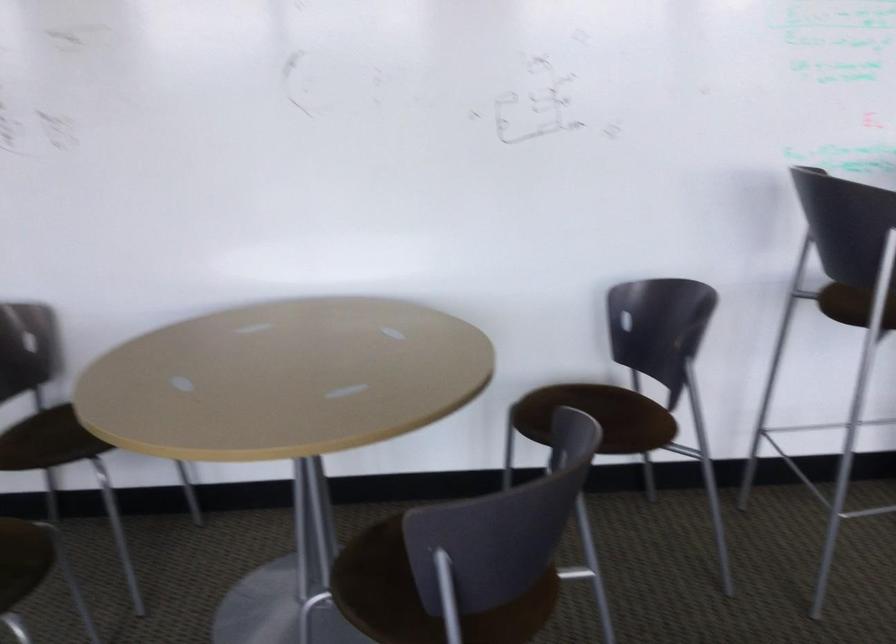
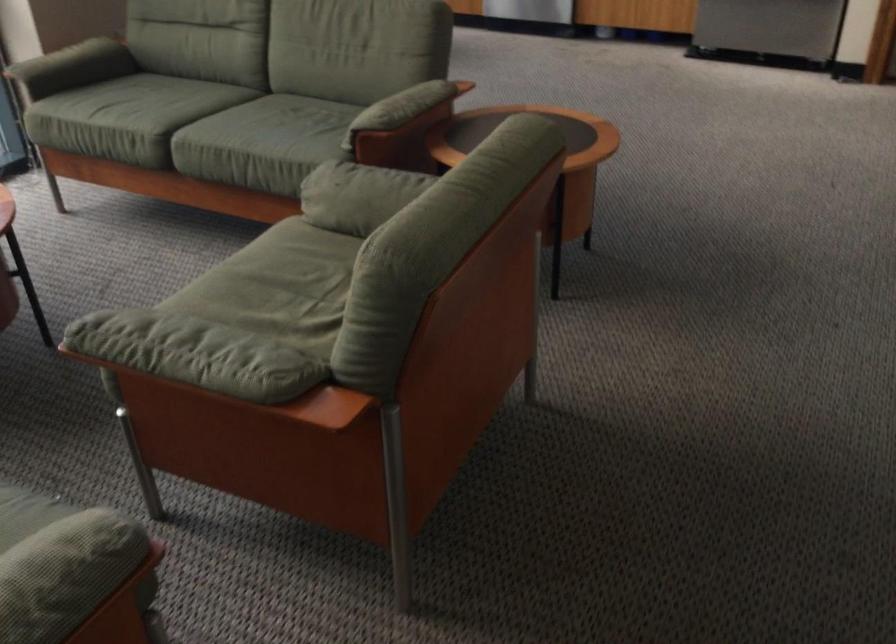
The first image is from the beginning of the video and the second image is from the end. How did the camera likely rotate when shooting the video?

The camera rotated toward left-down.